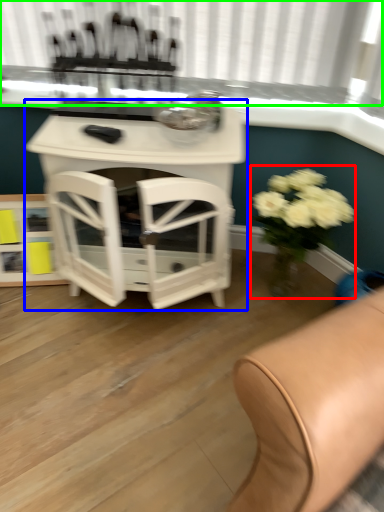
Question: Considering the real-world distances, which object is farthest from floral arrangement (highlighted by a red box)? table (highlighted by a blue box) or bay window (highlighted by a green box)?

Choices:
 (A) table
 (B) bay window

Answer: (B)